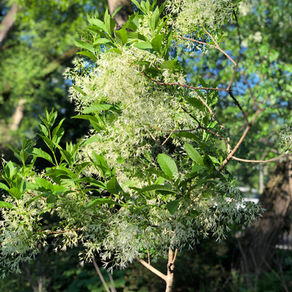
I want to click on window, so click(227, 193).